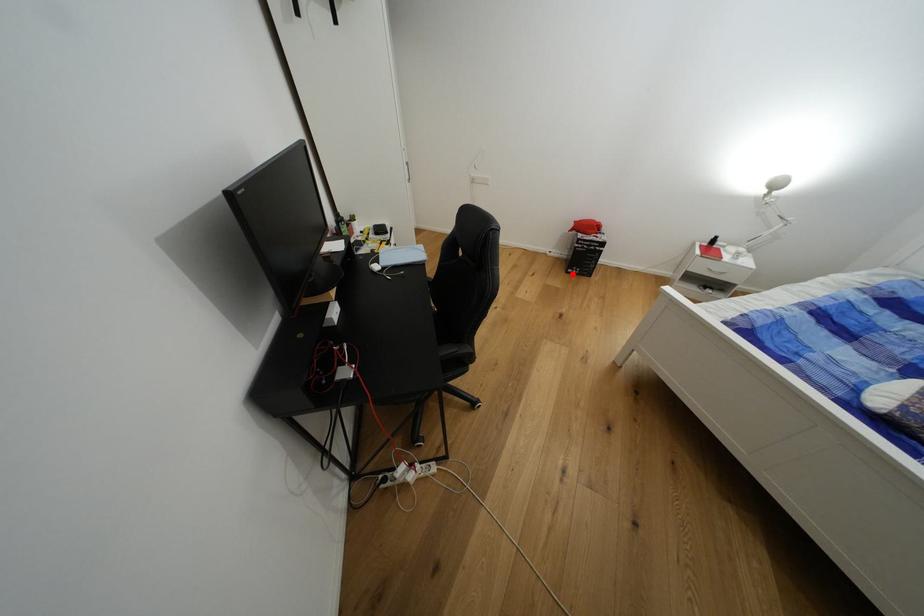
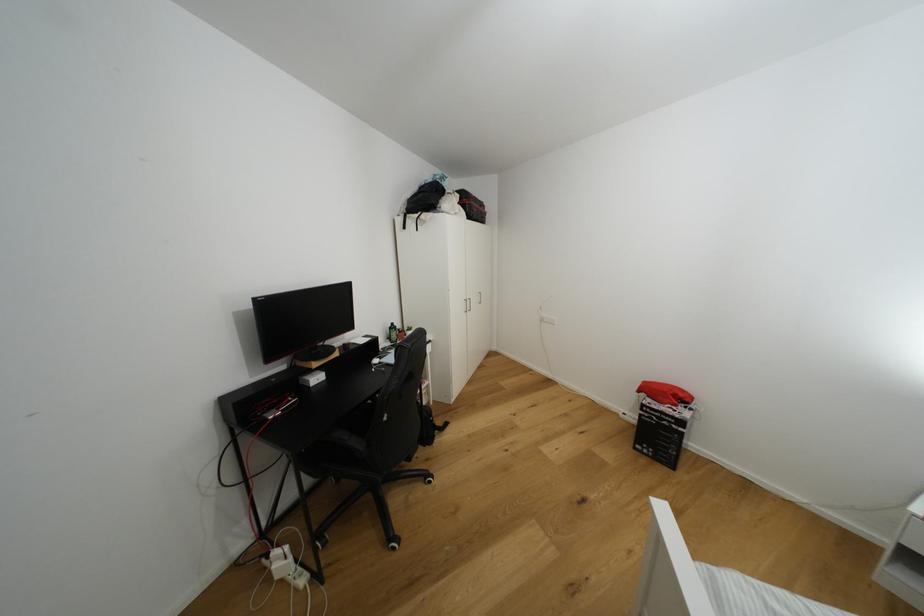
Where in the second image is the point corresponding to the highlighted location from the first image?

(639, 450)